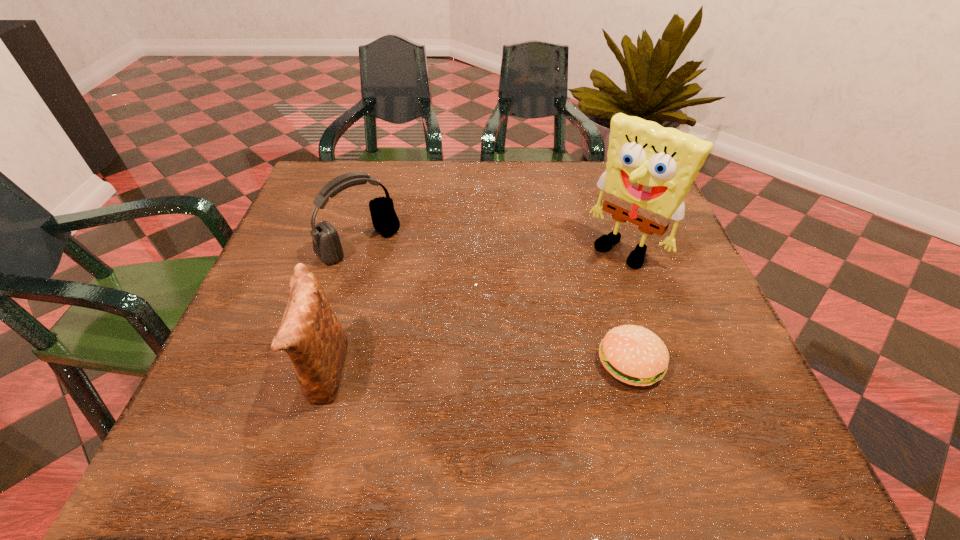
You are a GUI agent. You are given a task and a screenshot of the screen. Output one action in this format:
    pyautogui.click(x=<x>, y=<y>)
    Task: Click on the vacant space located 0.240m on the headband of the headset
    Image resolution: width=960 pixels, height=540 pixels.
    Given the screenshot: What is the action you would take?
    pyautogui.click(x=446, y=327)

The image size is (960, 540). Find the location of `clutch bag that is at the near edge`. clutch bag that is at the near edge is located at coordinates (310, 333).

Where is `patty situated at the near edge`? patty situated at the near edge is located at coordinates (632, 354).

You are a GUI agent. You are given a task and a screenshot of the screen. Output one action in this format:
    pyautogui.click(x=<x>, y=<y>)
    Task: Click on the clutch bag that is positioned at the left edge
    
    Given the screenshot: What is the action you would take?
    pyautogui.click(x=310, y=333)

Identify the location of headset that is at the left edge. The image size is (960, 540). (326, 243).

Where is `patty at the right edge`? The image size is (960, 540). patty at the right edge is located at coordinates (632, 354).

Find the location of a particular element. The height and width of the screenshot is (540, 960). sponge located in the right edge section of the desktop is located at coordinates (649, 171).

You are a GUI agent. You are given a task and a screenshot of the screen. Output one action in this format:
    pyautogui.click(x=<x>, y=<y>)
    Task: Click on the object positioned at the near left corner
    The height and width of the screenshot is (540, 960).
    Given the screenshot: What is the action you would take?
    pyautogui.click(x=310, y=333)

Identify the location of object that is at the near right corner. This screenshot has height=540, width=960. (632, 354).

Find the location of a particular element. This screenshot has height=540, width=960. free space at the far edge of the desktop is located at coordinates (521, 206).